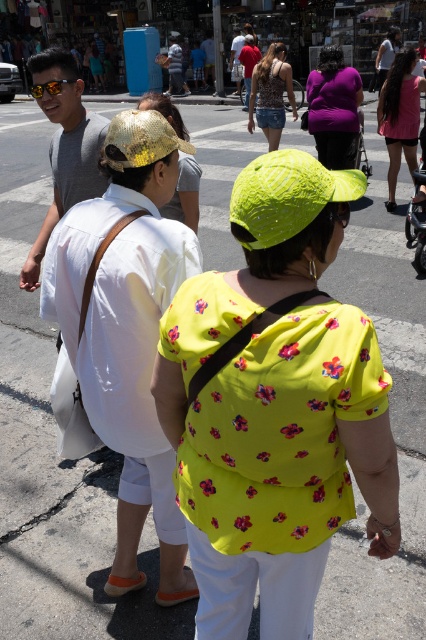
Question: Which point is farther to the camera?

Choices:
 (A) matte yellow cap at center
 (B) shiny gold hat at center

Answer: (B)

Question: Can you confirm if denim shorts at center is bigger than patterned fabric dress at center?

Choices:
 (A) yes
 (B) no

Answer: (A)

Question: Which object is farther from the camera taking this photo?

Choices:
 (A) shiny black goggles at center
 (B) matte yellow cap at center
 (C) patterned fabric dress at center
 (D) purple matte shirt at center

Answer: (C)

Question: Which object is closer to the camera taking this photo?

Choices:
 (A) shiny gold hat at center
 (B) pink fabric dress at upper right
 (C) denim shorts at center
 (D) patterned fabric dress at center

Answer: (A)

Question: Is purple matte shirt at center wider than denim shorts at center?

Choices:
 (A) no
 (B) yes

Answer: (A)

Question: Can you confirm if matte yellow cap at center is positioned to the right of purple matte shirt at center?

Choices:
 (A) no
 (B) yes

Answer: (A)